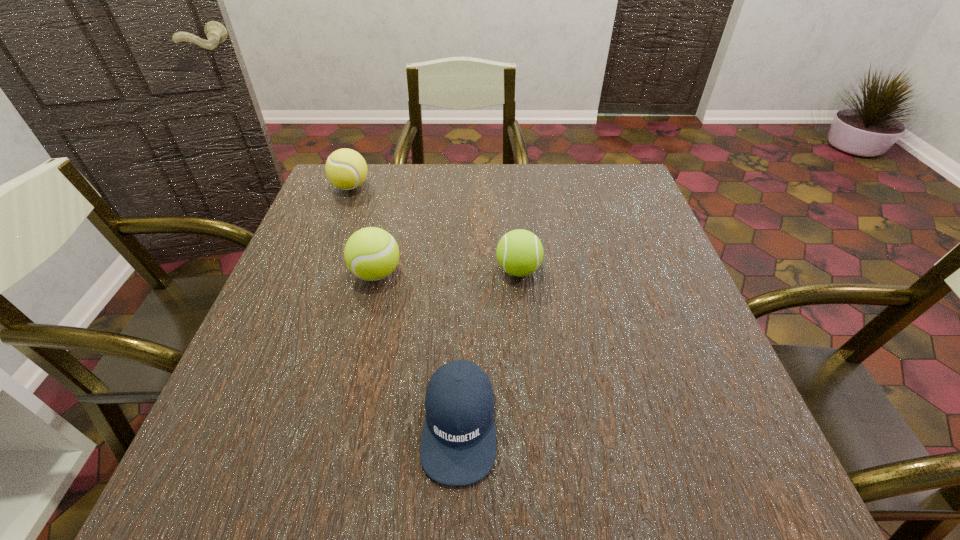
In order to click on the second tennis ball from right to left in this screenshot , I will do `click(371, 253)`.

The width and height of the screenshot is (960, 540). In order to click on the farthest object in this screenshot , I will do `click(346, 169)`.

At what (x,y) coordinates should I click in order to perform the action: click on the leftmost object. Please return your answer as a coordinate pair (x, y). Looking at the image, I should click on (346, 169).

The height and width of the screenshot is (540, 960). In order to click on the rightmost object in this screenshot , I will do `click(519, 252)`.

Where is `baseball cap`? The height and width of the screenshot is (540, 960). baseball cap is located at coordinates (458, 445).

Find the location of a particular element. The height and width of the screenshot is (540, 960). the shortest object is located at coordinates (458, 445).

Image resolution: width=960 pixels, height=540 pixels. In order to click on free spot located on the front of the third object from right to left in this screenshot , I will do `click(367, 313)`.

The height and width of the screenshot is (540, 960). In order to click on vacant space located 0.230m on the front of the leftmost tennis ball in this screenshot , I will do `click(325, 253)`.

Locate an element on the screen. The width and height of the screenshot is (960, 540). free space located 0.060m on the back of the rightmost tennis ball is located at coordinates (516, 239).

Where is `object that is at the far edge`? Image resolution: width=960 pixels, height=540 pixels. object that is at the far edge is located at coordinates (346, 169).